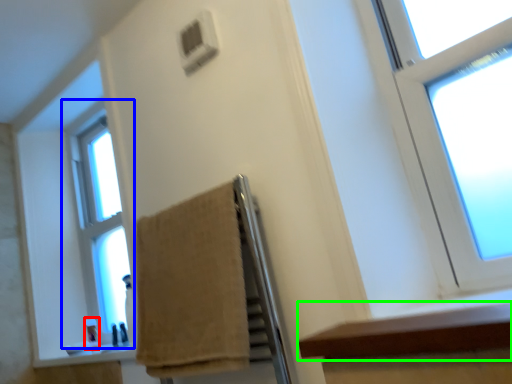
Question: Estimate the real-world distances between objects in this image. Which object is farther from toiletry (highlighted by a red box), window (highlighted by a blue box) or ledge (highlighted by a green box)?

Choices:
 (A) window
 (B) ledge

Answer: (B)